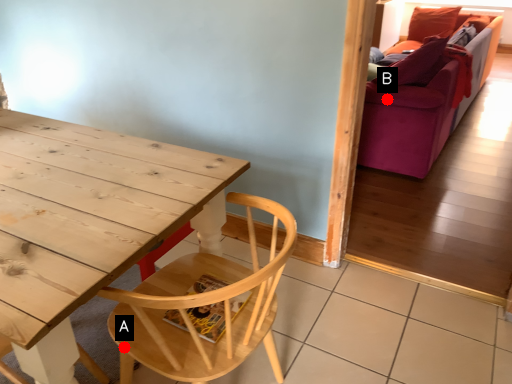
Question: Two points are circled on the image, labeled by A and B beside each circle. Which point is closer to the camera?

Choices:
 (A) A is closer
 (B) B is closer

Answer: (A)